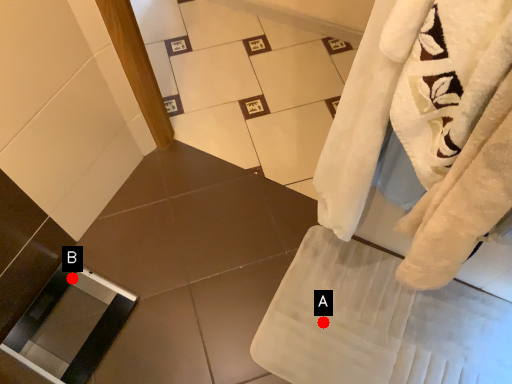
Question: Two points are circled on the image, labeled by A and B beside each circle. Which point is closer to the camera?

Choices:
 (A) A is closer
 (B) B is closer

Answer: (A)